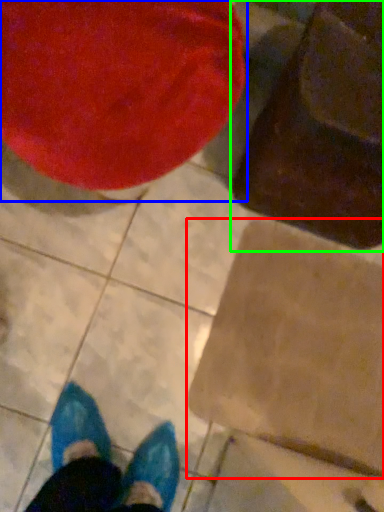
Question: Considering the real-world distances, which object is closest to cardboard box (highlighted by a red box)? bean bag chair (highlighted by a blue box) or bean bag chair (highlighted by a green box).

Choices:
 (A) bean bag chair
 (B) bean bag chair

Answer: (B)